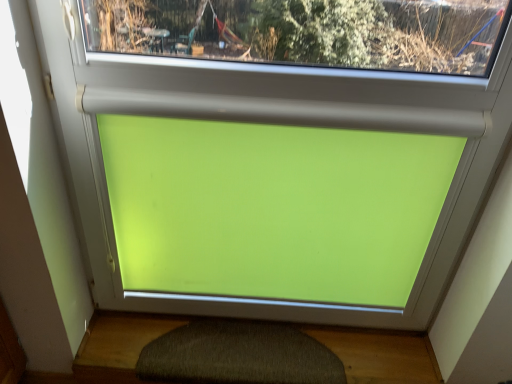
Locate an element on the screen. The image size is (512, 384). vacant area on top of dark gray textured bath mat at bottom (from a real-world perspective) is located at coordinates (245, 347).